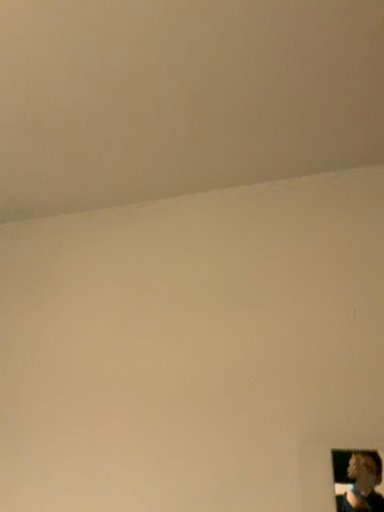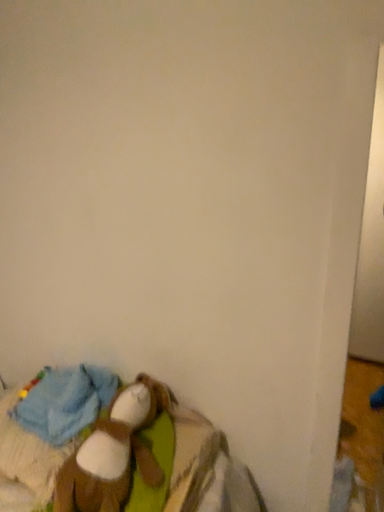
Question: How did the camera likely rotate when shooting the video?

Choices:
 (A) rotated right
 (B) rotated left

Answer: (B)